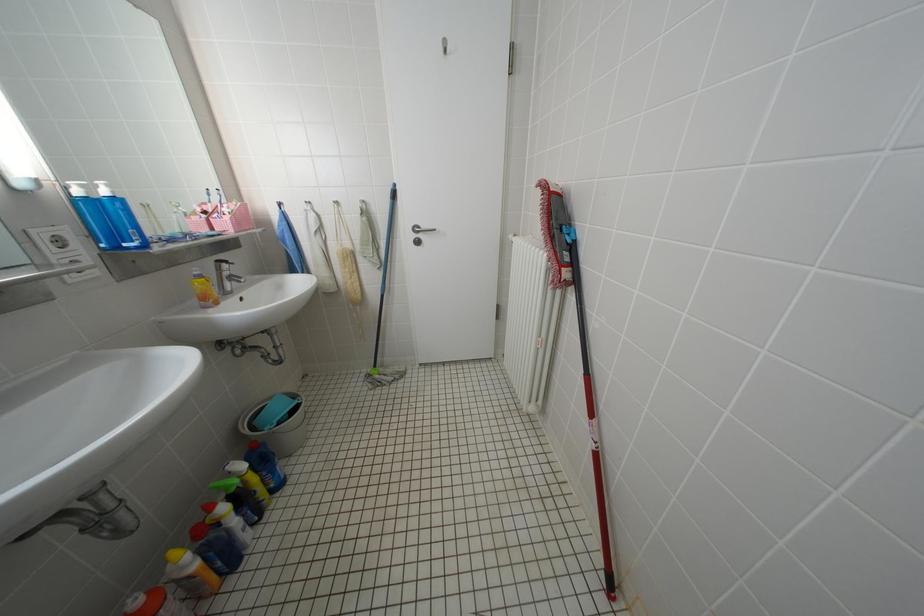
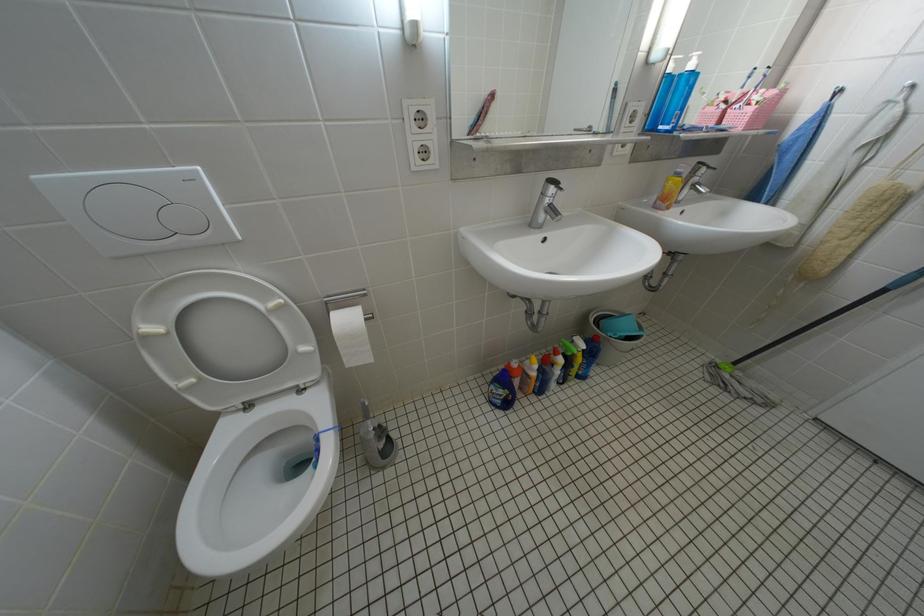
Based on the continuous images, in which direction is the camera rotating?

The camera's rotation is toward left-down.